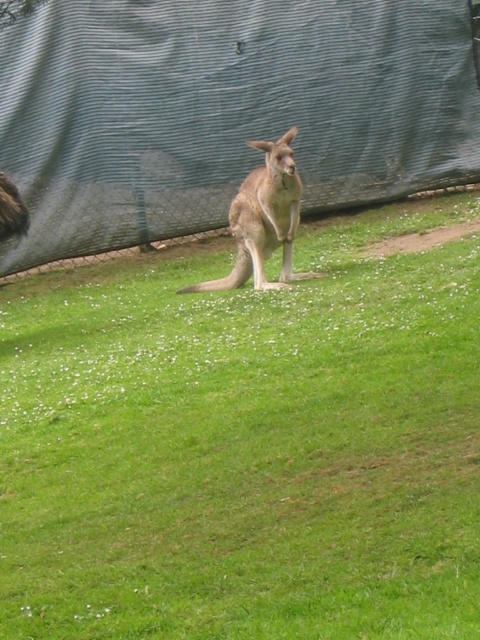
Question: Is the position of brown fur kangaroo at center more distant than that of greenish-brown fur kangaroo at center?

Choices:
 (A) no
 (B) yes

Answer: (A)

Question: Which of the following is the farthest from the observer?

Choices:
 (A) greenish-brown fur kangaroo at center
 (B) brown fur kangaroo at center

Answer: (A)

Question: Which object appears closest to the camera in this image?

Choices:
 (A) brown fur kangaroo at center
 (B) greenish-brown fur kangaroo at center

Answer: (A)

Question: Is brown fur kangaroo at center wider than greenish-brown fur kangaroo at center?

Choices:
 (A) yes
 (B) no

Answer: (B)

Question: Can you confirm if brown fur kangaroo at center is wider than greenish-brown fur kangaroo at center?

Choices:
 (A) no
 (B) yes

Answer: (A)